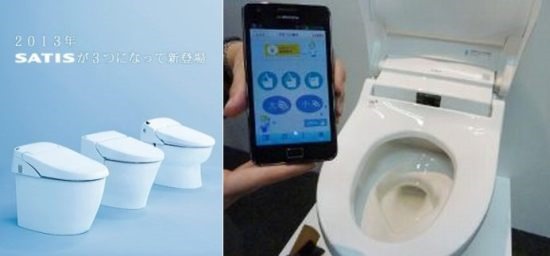
Find the location of a particular element. The image size is (550, 256). toilet bowl, inner is located at coordinates pos(404,157).